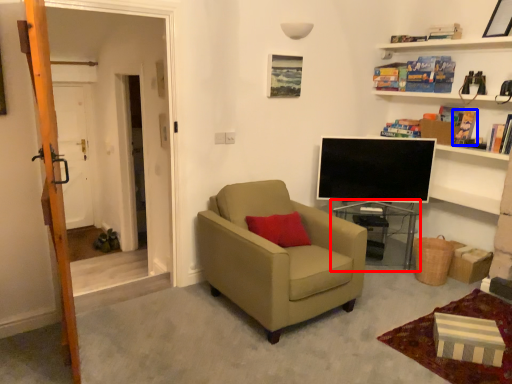
Question: Which point is closer to the camera, table (highlighted by a red box) or book (highlighted by a blue box)?

Choices:
 (A) table
 (B) book

Answer: (B)